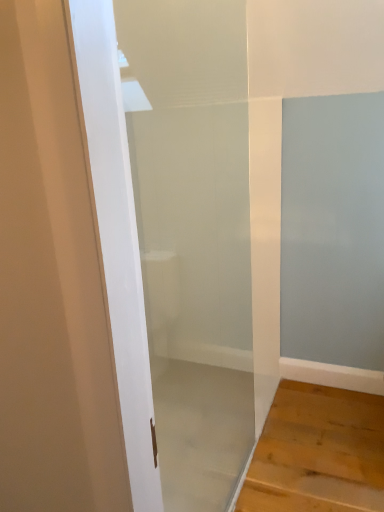
Locate an element on the screen. transparent glass screen door at center is located at coordinates (194, 238).

Describe the element at coordinates (194, 238) in the screenshot. The height and width of the screenshot is (512, 384). I see `transparent glass screen door at center` at that location.

Identify the location of transparent glass screen door at center. (194, 238).